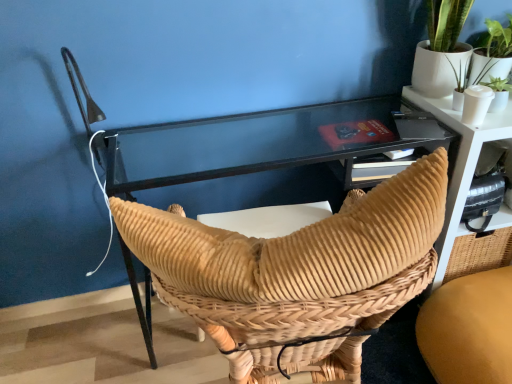
What do you see at coordinates (459, 164) in the screenshot? I see `matte black table at upper right` at bounding box center [459, 164].

The image size is (512, 384). What are the coordinates of `brown woven chair at center, marked as the first chair in a right-to-left arrangement` in the screenshot? It's located at (469, 329).

Where is `woven tan chair at center, marked as the 1th chair in a left-to-right arrangement`? woven tan chair at center, marked as the 1th chair in a left-to-right arrangement is located at coordinates (297, 273).

At what (x,y) coordinates should I click in order to perform the action: click on matte black table at upper right. Please return your answer as a coordinate pair (x, y). Looking at the image, I should click on (459, 164).

Does brown woven chair at center, marked as the first chair in a right-to-left arrangement, appear on the left side of matte black table at upper right?

Correct, you'll find brown woven chair at center, marked as the first chair in a right-to-left arrangement, to the left of matte black table at upper right.

Is point (500, 375) less distant than point (465, 230)?

Yes, point (500, 375) is in front of point (465, 230).

Which object is closer to the camera, brown woven chair at center, the second chair in the left-to-right sequence, or matte black table at upper right?

brown woven chair at center, the second chair in the left-to-right sequence, is more forward.

Considering the sizes of objects brown woven chair at center, the second chair in the left-to-right sequence, and matte black table at upper right in the image provided, who is bigger, brown woven chair at center, the second chair in the left-to-right sequence, or matte black table at upper right?

With larger size is matte black table at upper right.

Considering the sizes of objects woven tan chair at center, which is the 2th chair in right-to-left order, and matte black table at upper right in the image provided, who is taller, woven tan chair at center, which is the 2th chair in right-to-left order, or matte black table at upper right?

With more height is woven tan chair at center, which is the 2th chair in right-to-left order.

Does woven tan chair at center, which is the 2th chair in right-to-left order, turn towards matte black table at upper right?

No, woven tan chair at center, which is the 2th chair in right-to-left order, is not oriented towards matte black table at upper right.

Is point (303, 285) positioned in front of point (445, 117)?

Yes, it is in front of point (445, 117).

From the picture: Is there a large distance between woven tan chair at center, which is the 2th chair in right-to-left order, and matte black table at upper right?

woven tan chair at center, which is the 2th chair in right-to-left order, is actually quite close to matte black table at upper right.

In the scene shown: From the image's perspective, which one is positioned lower, matte black table at upper right or woven tan chair at center, which is the 2th chair in right-to-left order?

From the image's view, woven tan chair at center, which is the 2th chair in right-to-left order, is below.

From a real-world perspective, between matte black table at upper right and woven tan chair at center, marked as the 1th chair in a left-to-right arrangement, who is vertically lower?

matte black table at upper right.

Which is more to the right, matte black table at upper right or woven tan chair at center, which is the 2th chair in right-to-left order?

matte black table at upper right.

Do you think matte black table at upper right is within woven tan chair at center, which is the 2th chair in right-to-left order, or outside of it?

matte black table at upper right is not enclosed by woven tan chair at center, which is the 2th chair in right-to-left order.

Considering the points (504, 277) and (227, 355), which point is in front, point (504, 277) or point (227, 355)?

The point (227, 355) is closer to the camera.

Measure the distance from brown woven chair at center, the second chair in the left-to-right sequence, to woven tan chair at center, marked as the 1th chair in a left-to-right arrangement.

A distance of 25.59 inches exists between brown woven chair at center, the second chair in the left-to-right sequence, and woven tan chair at center, marked as the 1th chair in a left-to-right arrangement.

What's the angular difference between brown woven chair at center, the second chair in the left-to-right sequence, and woven tan chair at center, marked as the 1th chair in a left-to-right arrangement,'s facing directions?

There is a 97.7-degree angle between the facing directions of brown woven chair at center, the second chair in the left-to-right sequence, and woven tan chair at center, marked as the 1th chair in a left-to-right arrangement.

Is brown woven chair at center, marked as the first chair in a right-to-left arrangement, in contact with woven tan chair at center, which is the 2th chair in right-to-left order?

There is a gap between brown woven chair at center, marked as the first chair in a right-to-left arrangement, and woven tan chair at center, which is the 2th chair in right-to-left order.

Which object is closer to the camera, woven tan chair at center, marked as the 1th chair in a left-to-right arrangement, or brown woven chair at center, the second chair in the left-to-right sequence?

Positioned in front is woven tan chair at center, marked as the 1th chair in a left-to-right arrangement.

Are woven tan chair at center, which is the 2th chair in right-to-left order, and brown woven chair at center, marked as the first chair in a right-to-left arrangement, far apart?

Actually, woven tan chair at center, which is the 2th chair in right-to-left order, and brown woven chair at center, marked as the first chair in a right-to-left arrangement, are a little close together.

Which of these two, woven tan chair at center, marked as the 1th chair in a left-to-right arrangement, or brown woven chair at center, the second chair in the left-to-right sequence, stands shorter?

brown woven chair at center, the second chair in the left-to-right sequence, is shorter.

Consider the image. Is matte black table at upper right to the left of brown woven chair at center, marked as the first chair in a right-to-left arrangement, from the viewer's perspective?

No, matte black table at upper right is not to the left of brown woven chair at center, marked as the first chair in a right-to-left arrangement.

From a real-world perspective, is matte black table at upper right below brown woven chair at center, the second chair in the left-to-right sequence?

No, from a real-world perspective, matte black table at upper right is not beneath brown woven chair at center, the second chair in the left-to-right sequence.

Considering the sizes of objects matte black table at upper right and brown woven chair at center, the second chair in the left-to-right sequence, in the image provided, who is thinner, matte black table at upper right or brown woven chair at center, the second chair in the left-to-right sequence,?

matte black table at upper right.

Between matte black table at upper right and brown woven chair at center, marked as the first chair in a right-to-left arrangement, which one is positioned behind?

matte black table at upper right is further away from the camera.

The height and width of the screenshot is (384, 512). In order to click on table behind the brown woven chair at center, marked as the first chair in a right-to-left arrangement in this screenshot , I will do [459, 164].

The height and width of the screenshot is (384, 512). What are the coordinates of `chair above the matte black table at upper right (from a real-world perspective)` in the screenshot? It's located at (297, 273).

From the picture: Looking at the image, which one is located further to woven tan chair at center, marked as the 1th chair in a left-to-right arrangement, matte black table at upper right or brown woven chair at center, marked as the first chair in a right-to-left arrangement?

matte black table at upper right is further to woven tan chair at center, marked as the 1th chair in a left-to-right arrangement.

Looking at the image, which one is located further to matte black table at upper right, woven tan chair at center, which is the 2th chair in right-to-left order, or brown woven chair at center, marked as the first chair in a right-to-left arrangement?

woven tan chair at center, which is the 2th chair in right-to-left order, lies further to matte black table at upper right than the other object.

When comparing their distances from woven tan chair at center, marked as the 1th chair in a left-to-right arrangement, does brown woven chair at center, marked as the first chair in a right-to-left arrangement, or matte black table at upper right seem further?

matte black table at upper right lies further to woven tan chair at center, marked as the 1th chair in a left-to-right arrangement, than the other object.

Estimate the real-world distances between objects in this image. Which object is further from matte black table at upper right, brown woven chair at center, marked as the first chair in a right-to-left arrangement, or woven tan chair at center, which is the 2th chair in right-to-left order?

woven tan chair at center, which is the 2th chair in right-to-left order.

From the image, which object appears to be farther from brown woven chair at center, the second chair in the left-to-right sequence, matte black table at upper right or woven tan chair at center, which is the 2th chair in right-to-left order?

The object further to brown woven chair at center, the second chair in the left-to-right sequence, is woven tan chair at center, which is the 2th chair in right-to-left order.

From the image, which object appears to be nearer to brown woven chair at center, marked as the first chair in a right-to-left arrangement, woven tan chair at center, which is the 2th chair in right-to-left order, or matte black table at upper right?

matte black table at upper right.

This screenshot has height=384, width=512. I want to click on chair between woven tan chair at center, which is the 2th chair in right-to-left order, and matte black table at upper right, in the horizontal direction, so click(x=469, y=329).